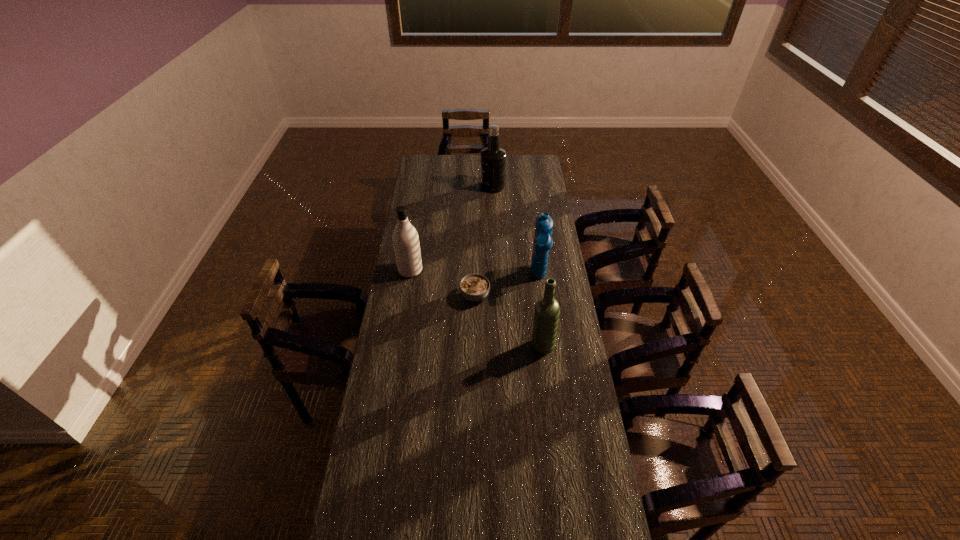
Where is `liquor`? This screenshot has width=960, height=540. liquor is located at coordinates (493, 158).

Where is `the nearest object`? This screenshot has width=960, height=540. the nearest object is located at coordinates (546, 316).

You are a GUI agent. You are given a task and a screenshot of the screen. Output one action in this format:
    pyautogui.click(x=<x>, y=<y>)
    Task: Click on the leftmost object
    The height and width of the screenshot is (540, 960).
    Given the screenshot: What is the action you would take?
    pyautogui.click(x=405, y=238)

Find the location of a particular element. the right shampoo is located at coordinates (542, 243).

Where is `the shortest object`? the shortest object is located at coordinates (474, 287).

The width and height of the screenshot is (960, 540). What are the coordinates of `free space located 0.120m on the front label of the farthest object` in the screenshot? It's located at (459, 187).

At what (x,y) coordinates should I click in order to perform the action: click on free space located on the front label of the farthest object. Please return your answer as a coordinate pair (x, y). This screenshot has height=540, width=960. Looking at the image, I should click on (452, 187).

Identify the location of vacant space located on the front label of the farthest object. (419, 187).

Locate an element on the screen. free point located 0.360m on the left of the nearest object is located at coordinates (438, 346).

Image resolution: width=960 pixels, height=540 pixels. Find the location of `vacant region located 0.220m on the front-facing side of the left shampoo`. vacant region located 0.220m on the front-facing side of the left shampoo is located at coordinates (470, 271).